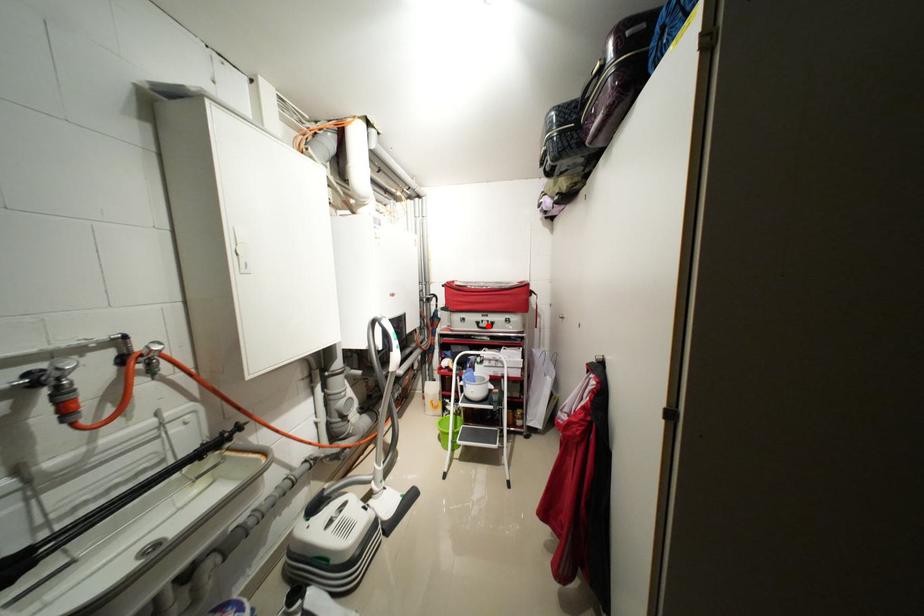
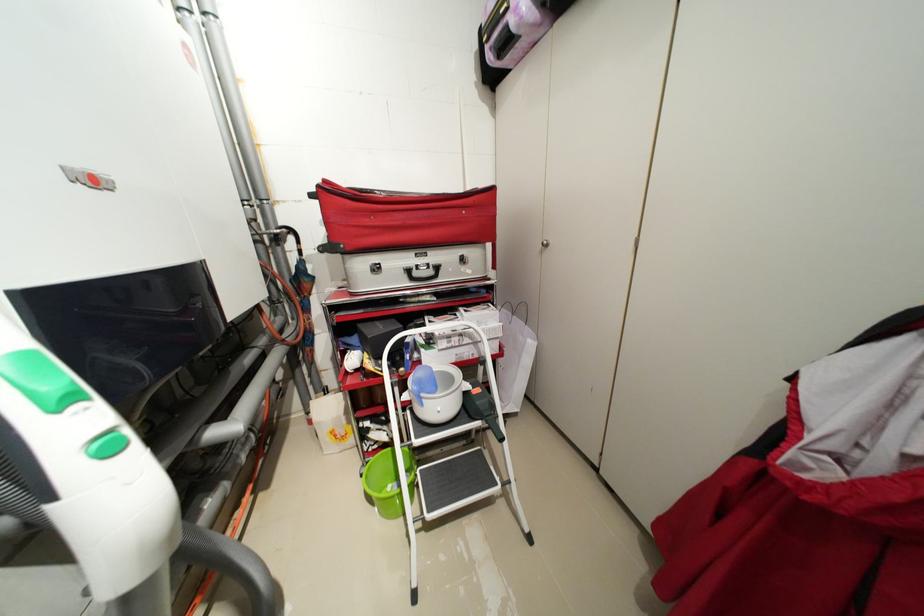
Locate, in the second image, the point that corresponds to the highlighted location in the first image.

(422, 275)